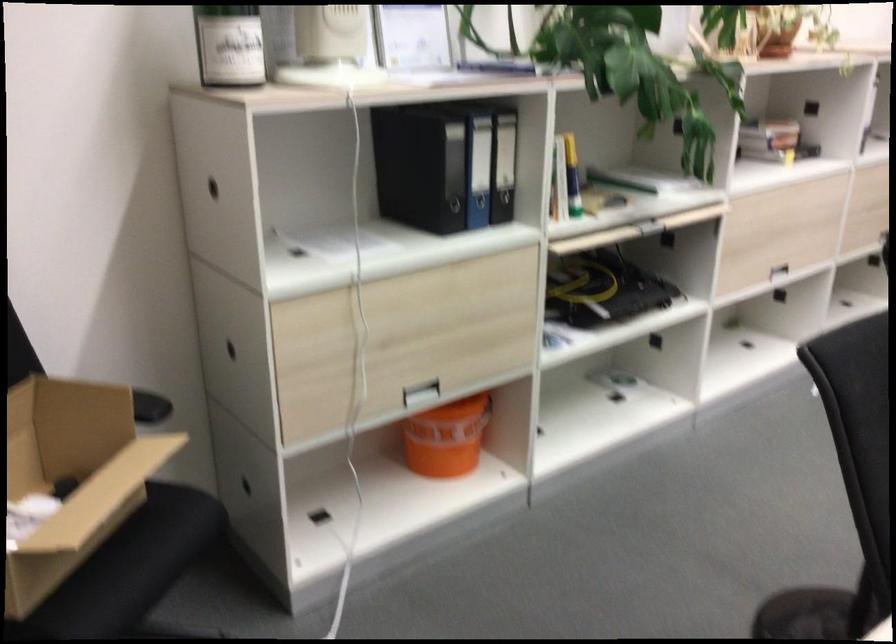
Where is `blue binder`? The width and height of the screenshot is (896, 644). blue binder is located at coordinates (478, 169).